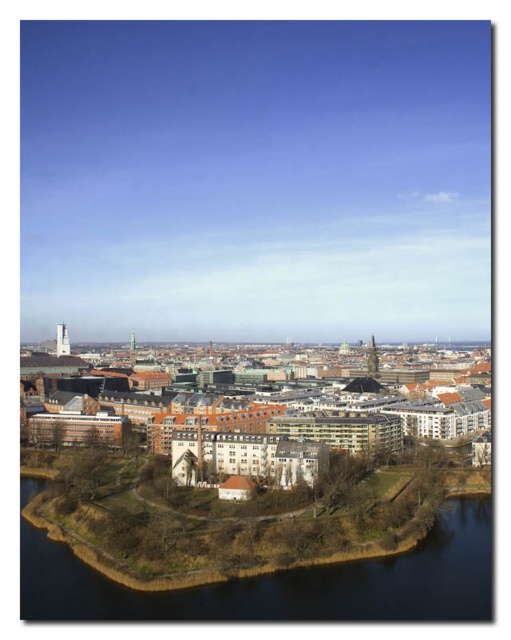
Is brown brick buildings at center wider than dark blue water at lower left?

Yes.

Who is shorter, brown brick buildings at center or dark blue water at lower left?

Standing shorter between the two is dark blue water at lower left.

Does point (414, 401) come behind point (142, 595)?

Yes, point (414, 401) is behind point (142, 595).

Where is `brown brick buildings at center`? This screenshot has height=640, width=511. brown brick buildings at center is located at coordinates (276, 426).